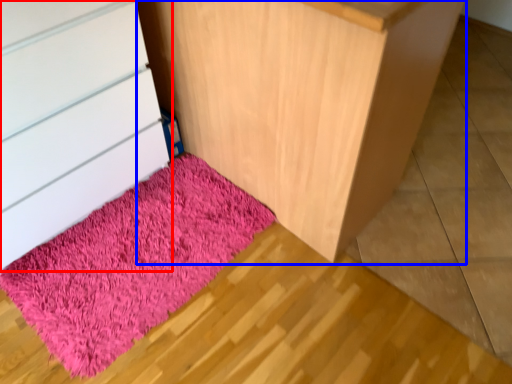
Question: Which of the following is the farthest to the observer, chest of drawers (highlighted by a red box) or furniture (highlighted by a blue box)?

Choices:
 (A) chest of drawers
 (B) furniture

Answer: (A)